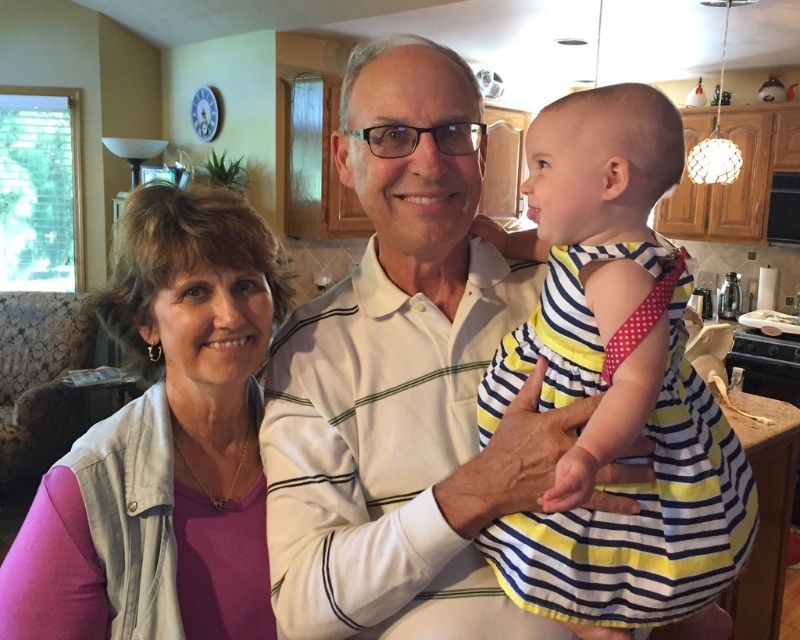
Which of these two, white striped shirt at center or striped cotton dress at center, stands taller?

white striped shirt at center

Between white striped shirt at center and striped cotton dress at center, which one appears on the right side from the viewer's perspective?

striped cotton dress at center

Does point (421, 337) come in front of point (740, 528)?

No.

I want to click on white striped shirt at center, so click(404, 381).

Measure the distance from white striped shirt at center to pink fabric at left.

white striped shirt at center and pink fabric at left are 6.87 inches apart.

Between point (412, 374) and point (242, 618), which one is positioned behind?

Point (242, 618)

At what (x,y) coordinates should I click in order to perform the action: click on white striped shirt at center. Please return your answer as a coordinate pair (x, y). This screenshot has width=800, height=640. Looking at the image, I should click on (404, 381).

Does point (560, 486) come in front of point (26, 588)?

That is True.

Measure the distance between striped cotton dress at center and pink fabric at left.

striped cotton dress at center is 16.04 inches away from pink fabric at left.

Where is `striped cotton dress at center`? The width and height of the screenshot is (800, 640). striped cotton dress at center is located at coordinates (613, 380).